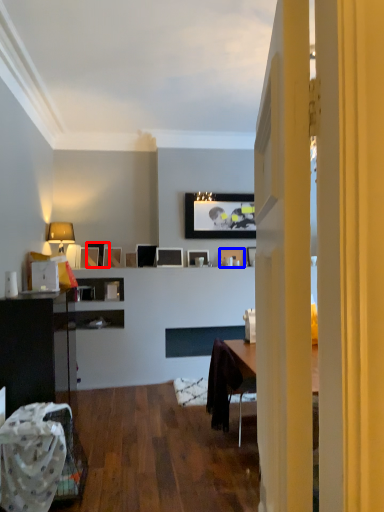
Question: Which object is closer to the camera taking this photo, picture frame (highlighted by a red box) or picture frame (highlighted by a blue box)?

Choices:
 (A) picture frame
 (B) picture frame

Answer: (A)